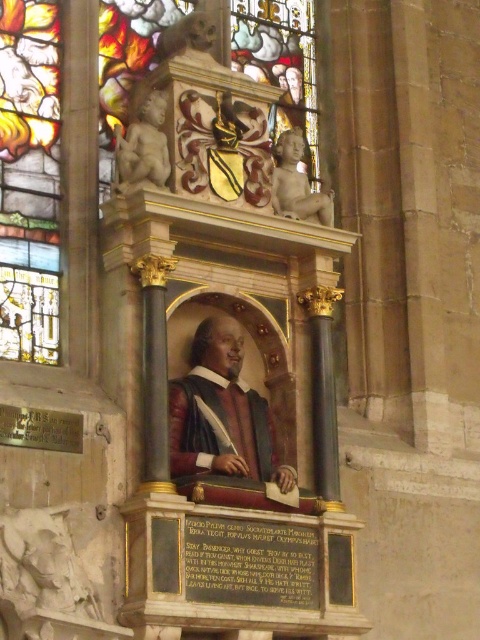
Which is in front, point (149, 102) or point (300, 140)?

Point (149, 102) is more forward.

Can you confirm if matte stone cherub at upper left is shorter than smooth marble cherub at upper right?

In fact, matte stone cherub at upper left may be taller than smooth marble cherub at upper right.

Between point (131, 163) and point (325, 216), which one is positioned behind?

The point (325, 216) is behind.

Locate an element on the screen. This screenshot has width=480, height=640. matte stone cherub at upper left is located at coordinates tap(144, 145).

Between point (194, 344) and point (121, 172), which one is positioned in front?

Point (121, 172)

Between point (255, 429) and point (146, 157), which one is positioned behind?

Positioned behind is point (255, 429).

Is point (249, 477) farther from viewer compared to point (163, 120)?

No.

At what (x,y) coordinates should I click in order to perform the action: click on smooth wooden portrait at center. Please return your answer as a coordinate pair (x, y). Looking at the image, I should click on (222, 413).

Does point (12, 13) come closer to viewer compared to point (211, 384)?

No.

Where is `stained glass window at upper center`? The image size is (480, 640). stained glass window at upper center is located at coordinates (29, 179).

I want to click on stained glass window at upper center, so click(x=29, y=179).